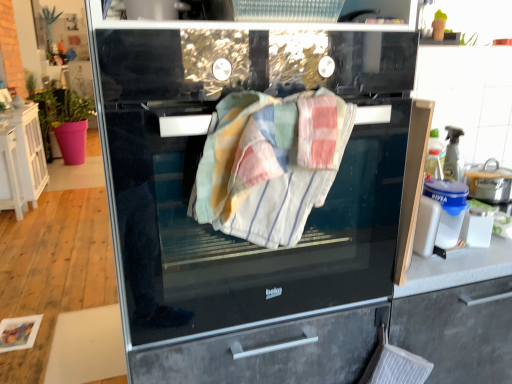
Image resolution: width=512 pixels, height=384 pixels. I want to click on white wood cabinet at left, so click(x=24, y=159).

What do you see at coordinates (270, 164) in the screenshot?
I see `patchwork cotton towel at center` at bounding box center [270, 164].

Where is `white wood cabinet at left`? white wood cabinet at left is located at coordinates (24, 159).

Which is nearer, (340, 108) or (15, 117)?

The point (340, 108) is closer to the camera.

Is white wood cabinet at left completely or partially inside patchwork cotton towel at center?

No, white wood cabinet at left is not a part of patchwork cotton towel at center.

Looking at this image, does patchwork cotton towel at center touch white wood cabinet at left?

No, patchwork cotton towel at center is not beside white wood cabinet at left.

From the picture: What's the angular difference between black glass oven at center and patchwork cotton towel at center's facing directions?

There is a 90-degree angle between the facing directions of black glass oven at center and patchwork cotton towel at center.

From the picture: Does black glass oven at center have a larger size compared to patchwork cotton towel at center?

Yes, black glass oven at center is bigger than patchwork cotton towel at center.

Considering the sizes of objects black glass oven at center and patchwork cotton towel at center in the image provided, who is shorter, black glass oven at center or patchwork cotton towel at center?

Standing shorter between the two is patchwork cotton towel at center.

From the image's perspective, between black glass oven at center and patchwork cotton towel at center, who is located below?

black glass oven at center.

Does white wood cabinet at left have a lesser width compared to blue plastic container at right?

No.

From a real-world perspective, who is located higher, white wood cabinet at left or blue plastic container at right?

From a 3D spatial view, blue plastic container at right is above.

Is white wood cabinet at left further to the viewer compared to blue plastic container at right?

That is True.

Image resolution: width=512 pixels, height=384 pixels. What are the coordinates of `home appliance lying on the right of white wood cabinet at left` in the screenshot? It's located at (254, 194).

Are black glass oven at center and white wood cabinet at left located far from each other?

Yes, black glass oven at center and white wood cabinet at left are quite far apart.

Does black glass oven at center have a lesser width compared to white wood cabinet at left?

No, black glass oven at center is not thinner than white wood cabinet at left.

Are patchwork cotton towel at center and blue plastic container at right located far from each other?

No, patchwork cotton towel at center is not far from blue plastic container at right.

In the image, is patchwork cotton towel at center on the left side or the right side of blue plastic container at right?

patchwork cotton towel at center is positioned on blue plastic container at right's left side.

Is blue plastic container at right a part of patchwork cotton towel at center?

Definitely not — blue plastic container at right is not inside patchwork cotton towel at center.

Which is behind, point (265, 118) or point (480, 178)?

The point (480, 178) is farther.

From their relative heights in the image, would you say white wood cabinet at left is taller or shorter than black glass oven at center?

Clearly, white wood cabinet at left is shorter compared to black glass oven at center.

From a real-world perspective, is white wood cabinet at left beneath black glass oven at center?

Correct, in the physical world, white wood cabinet at left is lower than black glass oven at center.

Can you see white wood cabinet at left touching black glass oven at center?

No, white wood cabinet at left is not in contact with black glass oven at center.

Is white wood cabinet at left oriented away from black glass oven at center?

No, black glass oven at center is not at the back of white wood cabinet at left.

Locate an element on the screen. This screenshot has height=384, width=512. bath towel located above the blue plastic container at right (from a real-world perspective) is located at coordinates pos(270,164).

Can you see blue plastic container at right touching patchwork cotton towel at center?

They are not placed beside each other.

Considering the sizes of blue plastic container at right and patchwork cotton towel at center in the image, is blue plastic container at right taller or shorter than patchwork cotton towel at center?

blue plastic container at right is shorter than patchwork cotton towel at center.

From the image's perspective, is blue plastic container at right beneath patchwork cotton towel at center?

No, from the image's perspective, blue plastic container at right is not beneath patchwork cotton towel at center.

The image size is (512, 384). Identify the location of cabinetry that is above the patchwork cotton towel at center (from the image's perspective). (24, 159).

Identify the location of home appliance in front of the patchwork cotton towel at center. The width and height of the screenshot is (512, 384). (254, 194).

When comparing their distances from patchwork cotton towel at center, does black glass oven at center or white wood cabinet at left seem closer?

The object closer to patchwork cotton towel at center is black glass oven at center.

Estimate the real-world distances between objects in this image. Which object is further from white wood cabinet at left, patchwork cotton towel at center or blue plastic container at right?

Based on the image, blue plastic container at right appears to be further to white wood cabinet at left.

Consider the image. Which object lies nearer to the anchor point black glass oven at center, blue plastic container at right or white wood cabinet at left?

blue plastic container at right.

From the image, which object appears to be nearer to blue plastic container at right, black glass oven at center or white wood cabinet at left?

black glass oven at center.

From the image, which object appears to be nearer to blue plastic container at right, patchwork cotton towel at center or white wood cabinet at left?

Among the two, patchwork cotton towel at center is located nearer to blue plastic container at right.

Considering their positions, is blue plastic container at right positioned further to white wood cabinet at left than patchwork cotton towel at center?

blue plastic container at right lies further to white wood cabinet at left than the other object.

Considering their positions, is black glass oven at center positioned further to white wood cabinet at left than patchwork cotton towel at center?

patchwork cotton towel at center is positioned further to the anchor white wood cabinet at left.

Based on their spatial positions, is black glass oven at center or blue plastic container at right closer to patchwork cotton towel at center?

black glass oven at center is positioned closer to the anchor patchwork cotton towel at center.

Where is `home appliance located between white wood cabinet at left and blue plastic container at right in the left-right direction`? The image size is (512, 384). home appliance located between white wood cabinet at left and blue plastic container at right in the left-right direction is located at coordinates (254, 194).

I want to click on bath towel between white wood cabinet at left and blue plastic container at right from left to right, so click(x=270, y=164).

Locate an element on the screen. bath towel between black glass oven at center and blue plastic container at right in the horizontal direction is located at coordinates (270, 164).

This screenshot has height=384, width=512. In order to click on bath towel positioned between black glass oven at center and white wood cabinet at left from near to far in this screenshot , I will do `click(270, 164)`.